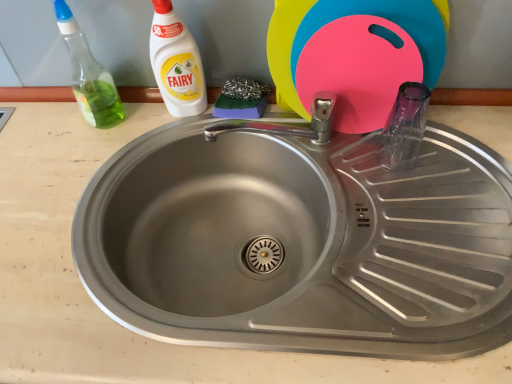
In order to face transparent glass bottle at right, should I rotate leftwards or rightwards?

You should rotate right by 20.218 degrees.

The width and height of the screenshot is (512, 384). Find the location of `pink plastic cutting board at upper right`. pink plastic cutting board at upper right is located at coordinates (354, 54).

The image size is (512, 384). I want to click on white plastic bottle at upper left, placed as the 2th cleaning product when sorted from left to right, so click(176, 63).

Identify the location of stainless steel sink at center. This screenshot has width=512, height=384. (302, 243).

Locate an element on the screen. The image size is (512, 384). green translucent spray bottle at left, marked as the second cleaning product in a right-to-left arrangement is located at coordinates (88, 75).

I want to click on transparent glass bottle at right, so click(404, 127).

Who is bigger, transparent glass bottle at right or white plastic bottle at upper left, placed as the 2th cleaning product when sorted from left to right?

Bigger between the two is white plastic bottle at upper left, placed as the 2th cleaning product when sorted from left to right.

From a real-world perspective, who is located lower, transparent glass bottle at right or white plastic bottle at upper left, placed as the 2th cleaning product when sorted from left to right?

transparent glass bottle at right.

Is transparent glass bottle at right thinner than white plastic bottle at upper left, which is counted as the 1th cleaning product, starting from the right?

No, transparent glass bottle at right is not thinner than white plastic bottle at upper left, which is counted as the 1th cleaning product, starting from the right.

Who is shorter, transparent glass bottle at right or white plastic bottle at upper left, placed as the 2th cleaning product when sorted from left to right?

Standing shorter between the two is transparent glass bottle at right.

Is white plastic bottle at upper left, which is counted as the 1th cleaning product, starting from the right, oriented away from stainless steel sink at center?

white plastic bottle at upper left, which is counted as the 1th cleaning product, starting from the right, is not turned away from stainless steel sink at center.

Which of these two, white plastic bottle at upper left, placed as the 2th cleaning product when sorted from left to right, or stainless steel sink at center, is bigger?

Bigger between the two is stainless steel sink at center.

Is white plastic bottle at upper left, placed as the 2th cleaning product when sorted from left to right, taller or shorter than stainless steel sink at center?

Clearly, white plastic bottle at upper left, placed as the 2th cleaning product when sorted from left to right, is shorter compared to stainless steel sink at center.

Which is nearer, (432, 16) or (169, 65)?

The point (432, 16) is more forward.

Does pink plastic cutting board at upper right touch white plastic bottle at upper left, placed as the 2th cleaning product when sorted from left to right?

No, pink plastic cutting board at upper right is not in contact with white plastic bottle at upper left, placed as the 2th cleaning product when sorted from left to right.

From the image's perspective, relative to white plastic bottle at upper left, placed as the 2th cleaning product when sorted from left to right, is pink plastic cutting board at upper right above or below?

Based on their image positions, pink plastic cutting board at upper right is located above white plastic bottle at upper left, placed as the 2th cleaning product when sorted from left to right.

Is pink plastic cutting board at upper right oriented away from white plastic bottle at upper left, placed as the 2th cleaning product when sorted from left to right?

No, pink plastic cutting board at upper right is not facing the opposite direction of white plastic bottle at upper left, placed as the 2th cleaning product when sorted from left to right.

From the image's perspective, which object appears higher, pink plastic cutting board at upper right or transparent glass bottle at right?

From the image's view, pink plastic cutting board at upper right is above.

Visually, is pink plastic cutting board at upper right positioned to the left or to the right of transparent glass bottle at right?

pink plastic cutting board at upper right is positioned on transparent glass bottle at right's left side.

Does pink plastic cutting board at upper right have a larger size compared to transparent glass bottle at right?

Yes.

At what (x,y) coordinates should I click in order to perform the action: click on toy lying above the transparent glass bottle at right (from the image's perspective). Please return your answer as a coordinate pair (x, y). This screenshot has height=384, width=512. Looking at the image, I should click on (354, 54).

Considering the positions of points (157, 21) and (118, 107), is point (157, 21) closer to camera compared to point (118, 107)?

Yes, it is in front of point (118, 107).

This screenshot has height=384, width=512. In order to click on cleaning product behind the green translucent spray bottle at left, which is counted as the first cleaning product, starting from the left in this screenshot , I will do [176, 63].

Is white plastic bottle at upper left, which is counted as the 1th cleaning product, starting from the right, positioned with its back to green translucent spray bottle at left, marked as the second cleaning product in a right-to-left arrangement?

white plastic bottle at upper left, which is counted as the 1th cleaning product, starting from the right, is not turned away from green translucent spray bottle at left, marked as the second cleaning product in a right-to-left arrangement.

Is green translucent spray bottle at left, which is counted as the first cleaning product, starting from the left, located within white plastic bottle at upper left, which is counted as the 1th cleaning product, starting from the right?

No.

From the picture: Which of these two, stainless steel sink at center or white plastic bottle at upper left, placed as the 2th cleaning product when sorted from left to right, stands shorter?

Standing shorter between the two is white plastic bottle at upper left, placed as the 2th cleaning product when sorted from left to right.

Is stainless steel sink at center far away from white plastic bottle at upper left, which is counted as the 1th cleaning product, starting from the right?

stainless steel sink at center is near white plastic bottle at upper left, which is counted as the 1th cleaning product, starting from the right, not far away.

What's the angular difference between stainless steel sink at center and white plastic bottle at upper left, placed as the 2th cleaning product when sorted from left to right,'s facing directions?

The angular difference between stainless steel sink at center and white plastic bottle at upper left, placed as the 2th cleaning product when sorted from left to right, is 0.0475 degrees.

Is stainless steel sink at center bigger than white plastic bottle at upper left, placed as the 2th cleaning product when sorted from left to right?

Yes, stainless steel sink at center is bigger than white plastic bottle at upper left, placed as the 2th cleaning product when sorted from left to right.

Which object is further away from the camera taking this photo, transparent glass bottle at right or green translucent spray bottle at left, which is counted as the first cleaning product, starting from the left?

transparent glass bottle at right is more distant.

Is green translucent spray bottle at left, marked as the second cleaning product in a right-to-left arrangement, inside transparent glass bottle at right?

No, green translucent spray bottle at left, marked as the second cleaning product in a right-to-left arrangement, is not surrounded by transparent glass bottle at right.

Locate an element on the screen. The height and width of the screenshot is (384, 512). bottle behind the green translucent spray bottle at left, which is counted as the first cleaning product, starting from the left is located at coordinates (404, 127).

Is transparent glass bottle at right turned away from green translucent spray bottle at left, which is counted as the first cleaning product, starting from the left?

No.

From a real-world perspective, count 1st cleaning products upward from the transparent glass bottle at right and point to it. Please provide its 2D coordinates.

[(176, 63)]

From the image's perspective, which cleaning product is the 1st one above the stainless steel sink at center? Please provide its 2D coordinates.

[(176, 63)]

From the picture: Which object lies further to the anchor point pink plastic cutting board at upper right, white plastic bottle at upper left, which is counted as the 1th cleaning product, starting from the right, or green translucent spray bottle at left, which is counted as the first cleaning product, starting from the left?

green translucent spray bottle at left, which is counted as the first cleaning product, starting from the left, is further to pink plastic cutting board at upper right.

Considering their positions, is pink plastic cutting board at upper right positioned closer to green translucent spray bottle at left, which is counted as the first cleaning product, starting from the left, than transparent glass bottle at right?

Based on the image, pink plastic cutting board at upper right appears to be nearer to green translucent spray bottle at left, which is counted as the first cleaning product, starting from the left.

Which object lies further to the anchor point white plastic bottle at upper left, placed as the 2th cleaning product when sorted from left to right, green translucent spray bottle at left, marked as the second cleaning product in a right-to-left arrangement, or transparent glass bottle at right?

Among the two, transparent glass bottle at right is located further to white plastic bottle at upper left, placed as the 2th cleaning product when sorted from left to right.

Considering their positions, is white plastic bottle at upper left, which is counted as the 1th cleaning product, starting from the right, positioned closer to green translucent spray bottle at left, marked as the second cleaning product in a right-to-left arrangement, than stainless steel sink at center?

white plastic bottle at upper left, which is counted as the 1th cleaning product, starting from the right.

From the image, which object appears to be farther from stainless steel sink at center, pink plastic cutting board at upper right or white plastic bottle at upper left, placed as the 2th cleaning product when sorted from left to right?

white plastic bottle at upper left, placed as the 2th cleaning product when sorted from left to right.

Based on their spatial positions, is pink plastic cutting board at upper right or green translucent spray bottle at left, marked as the second cleaning product in a right-to-left arrangement, further from stainless steel sink at center?

Among the two, green translucent spray bottle at left, marked as the second cleaning product in a right-to-left arrangement, is located further to stainless steel sink at center.

Looking at the image, which one is located further to pink plastic cutting board at upper right, green translucent spray bottle at left, which is counted as the first cleaning product, starting from the left, or white plastic bottle at upper left, which is counted as the 1th cleaning product, starting from the right?

green translucent spray bottle at left, which is counted as the first cleaning product, starting from the left, is further to pink plastic cutting board at upper right.

When comparing their distances from green translucent spray bottle at left, marked as the second cleaning product in a right-to-left arrangement, does pink plastic cutting board at upper right or stainless steel sink at center seem further?

pink plastic cutting board at upper right.

What are the coordinates of `toy situated between white plastic bottle at upper left, which is counted as the 1th cleaning product, starting from the right, and transparent glass bottle at right from left to right` in the screenshot? It's located at (354, 54).

Identify the location of cleaning product that lies between green translucent spray bottle at left, marked as the second cleaning product in a right-to-left arrangement, and stainless steel sink at center from top to bottom. The image size is (512, 384). (176, 63).

Find the location of `cleaning product between green translucent spray bottle at left, marked as the second cleaning product in a right-to-left arrangement, and pink plastic cutting board at upper right from left to right`. cleaning product between green translucent spray bottle at left, marked as the second cleaning product in a right-to-left arrangement, and pink plastic cutting board at upper right from left to right is located at coordinates (176, 63).

At what (x,y) coordinates should I click in order to perform the action: click on bottle between white plastic bottle at upper left, which is counted as the 1th cleaning product, starting from the right, and stainless steel sink at center vertically. Please return your answer as a coordinate pair (x, y). The image size is (512, 384). Looking at the image, I should click on (404, 127).